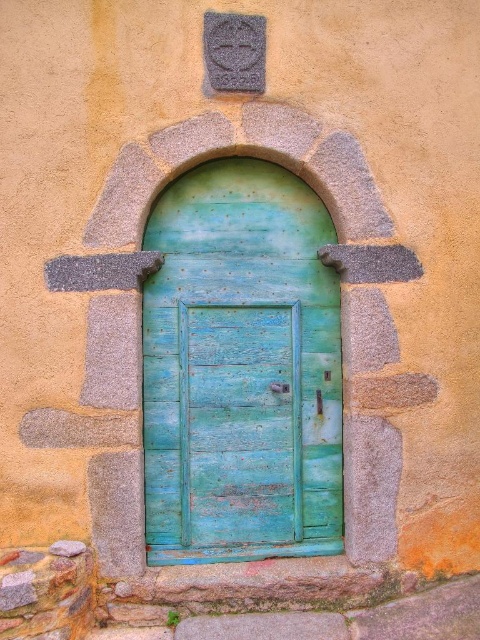
Question: Among these points, which one is farthest from the camera?

Choices:
 (A) (295, 480)
 (B) (255, 304)

Answer: (A)

Question: Among these objects, which one is farthest from the camera?

Choices:
 (A) blue wooden door at center
 (B) weathered teal wood door at center

Answer: (B)

Question: Can you confirm if blue wooden door at center is wider than weathered teal wood door at center?

Choices:
 (A) yes
 (B) no

Answer: (A)

Question: Is blue wooden door at center further to the viewer compared to weathered teal wood door at center?

Choices:
 (A) no
 (B) yes

Answer: (A)

Question: Which of the following is the farthest from the observer?

Choices:
 (A) weathered teal wood door at center
 (B) blue wooden door at center

Answer: (A)

Question: Is blue wooden door at center wider than weathered teal wood door at center?

Choices:
 (A) no
 (B) yes

Answer: (B)